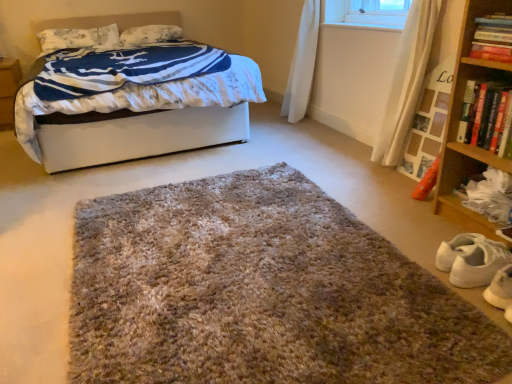
Locate an element on the screen. The width and height of the screenshot is (512, 384). empty space that is in between white soft bed at upper left and shaggy carpet at center is located at coordinates (116, 192).